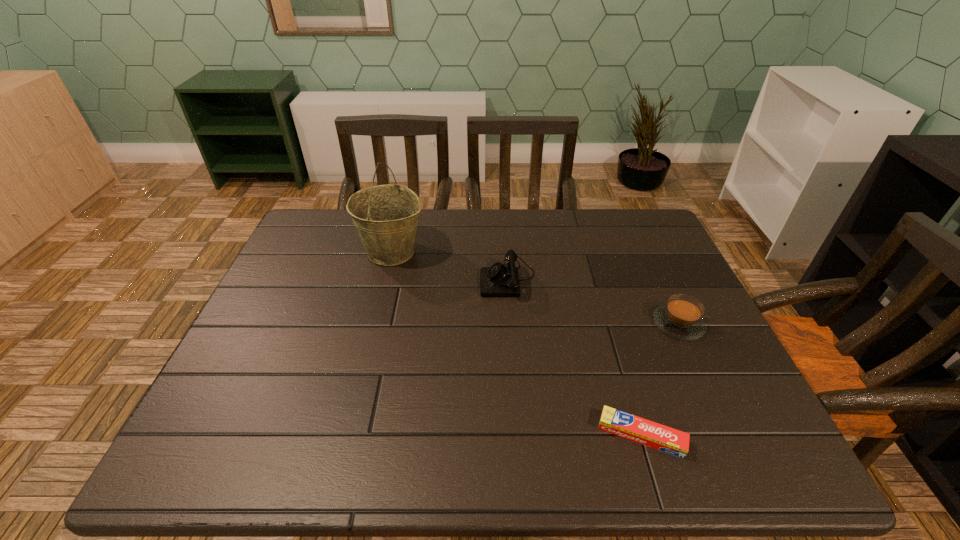
Where is `free space located on the front face of the second tallest object`? Image resolution: width=960 pixels, height=540 pixels. free space located on the front face of the second tallest object is located at coordinates (415, 278).

The image size is (960, 540). Identify the location of vacant area situated on the front face of the second tallest object. (386, 278).

The image size is (960, 540). What are the coordinates of `vacant space located 0.080m on the left of the rightmost object` in the screenshot? It's located at (621, 324).

Find the location of a particular element. The image size is (960, 540). vacant space located 0.140m on the left of the shortest object is located at coordinates (528, 435).

I want to click on object that is positioned at the far edge, so click(x=386, y=217).

The image size is (960, 540). What are the coordinates of `object that is positioned at the near edge` in the screenshot? It's located at (663, 438).

In order to click on object positioned at the right edge in this screenshot , I will do `click(681, 318)`.

Image resolution: width=960 pixels, height=540 pixels. What are the coordinates of `free space at the far edge of the desktop` in the screenshot? It's located at (518, 251).

Locate an element on the screen. vacant position at the near edge of the desktop is located at coordinates (649, 458).

Identify the location of free location at the left edge of the desktop. (298, 297).